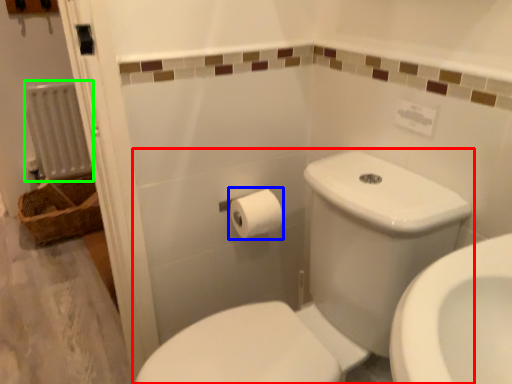
Question: Which is farther away from toilet (highlighted by a red box)? toilet paper (highlighted by a blue box) or radiator (highlighted by a green box)?

Choices:
 (A) toilet paper
 (B) radiator

Answer: (B)